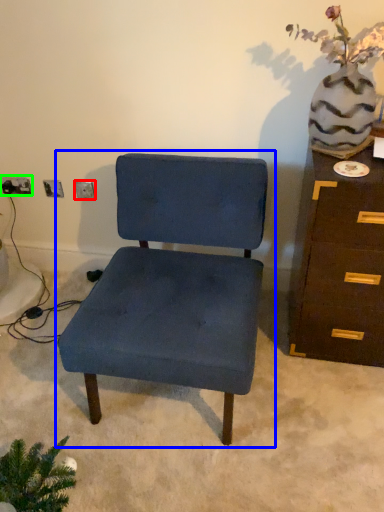
Question: Which is nearer to the electric outlet (highlighted by a red box)? chair (highlighted by a blue box) or electric outlet (highlighted by a green box).

Choices:
 (A) chair
 (B) electric outlet

Answer: (B)